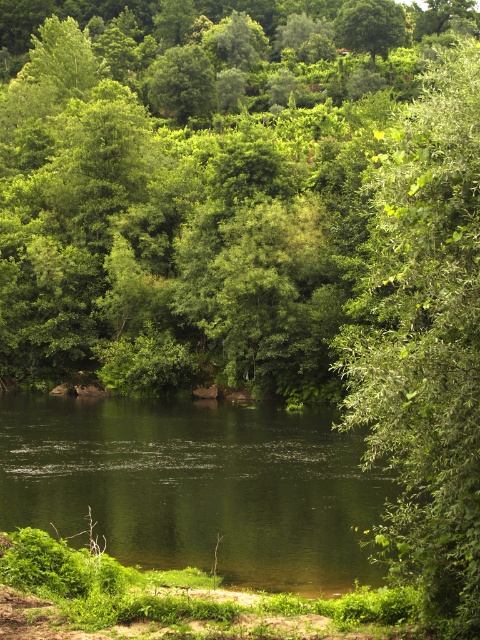
Consider the image. You are a bird looking for a nesting spot. You see the green leafy tree at center and the green leafy tree at right. Which tree would provide more space for your nest?

The green leafy tree at center is bigger than the green leafy tree at right, so it would provide more space for your nest.

You are standing at the origin point in the scene. Where is the green leafy tree at center located in terms of its 2D coordinates?

The green leafy tree at center is located at the 2D coordinates of point (228, 189).